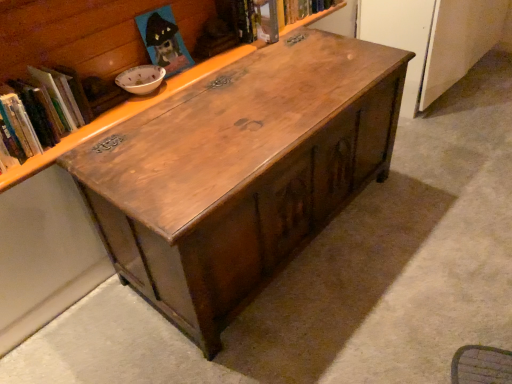
What do you see at coordinates (240, 172) in the screenshot? I see `wooden chest at center` at bounding box center [240, 172].

The width and height of the screenshot is (512, 384). What do you see at coordinates (41, 111) in the screenshot? I see `hardcover book at upper left, marked as the second book in a right-to-left arrangement` at bounding box center [41, 111].

Image resolution: width=512 pixels, height=384 pixels. What do you see at coordinates (120, 116) in the screenshot?
I see `wooden chest at center` at bounding box center [120, 116].

Locate an element on the screen. Image resolution: width=512 pixels, height=384 pixels. wooden chest at center is located at coordinates (240, 172).

In terms of height, does wooden chest at center look taller or shorter compared to hardcover book at upper left, arranged as the second book when viewed from the back?

wooden chest at center is taller than hardcover book at upper left, arranged as the second book when viewed from the back.

Which of these two, wooden chest at center or hardcover book at upper left, marked as the second book in a right-to-left arrangement, is bigger?

wooden chest at center is bigger.

Is wooden chest at center at the left side of hardcover book at upper left, the first book in the front-to-back sequence?

In fact, wooden chest at center is to the right of hardcover book at upper left, the first book in the front-to-back sequence.

Are wooden chest at center and hardcover book at upper left, marked as the second book in a right-to-left arrangement, making contact?

There is a gap between wooden chest at center and hardcover book at upper left, marked as the second book in a right-to-left arrangement.

Can you confirm if wooden chest at center is shorter than hardcover book at upper left, arranged as the second book when viewed from the back?

No, wooden chest at center is not shorter than hardcover book at upper left, arranged as the second book when viewed from the back.

Identify the location of the 1st book directly beneath the wooden chest at center (from a real-world perspective). This screenshot has height=384, width=512. (41, 111).

Considering the positions of objects wooden chest at center and hardcover book at upper left, the first book in the front-to-back sequence, in the image provided, who is behind, wooden chest at center or hardcover book at upper left, the first book in the front-to-back sequence,?

hardcover book at upper left, the first book in the front-to-back sequence, is behind.

From the image's perspective, would you say wooden chest at center is shown under wooden chest at center?

Incorrect, from the image's perspective, wooden chest at center is higher than wooden chest at center.

Can you tell me how much wooden chest at center and wooden chest at center differ in facing direction?

The angular difference between wooden chest at center and wooden chest at center is 0.000761 degrees.

Does point (24, 173) appear closer or farther from the camera than point (291, 217)?

Point (24, 173) is closer to the camera than point (291, 217).

Can we say wooden chest at center lies outside wooden chest at center?

Absolutely, wooden chest at center is external to wooden chest at center.

Which object is positioned more to the right, hardcover book at upper center, positioned as the 1th book in top-to-bottom order, or wooden chest at center?

Positioned to the right is hardcover book at upper center, positioned as the 1th book in top-to-bottom order.

Is wooden chest at center inside hardcover book at upper center, acting as the second book starting from the left?

Definitely not — wooden chest at center is not inside hardcover book at upper center, acting as the second book starting from the left.

Is hardcover book at upper center, acting as the second book starting from the left, far away from wooden chest at center?

That's not correct — hardcover book at upper center, acting as the second book starting from the left, is a little close to wooden chest at center.

Which of these two, hardcover book at upper center, which is counted as the first book, starting from the right, or wooden chest at center, is smaller?

With smaller size is hardcover book at upper center, which is counted as the first book, starting from the right.

Considering the relative sizes of hardcover book at upper center, positioned as the 1th book in top-to-bottom order, and wooden chest at center in the image provided, is hardcover book at upper center, positioned as the 1th book in top-to-bottom order, bigger than wooden chest at center?

Incorrect, hardcover book at upper center, positioned as the 1th book in top-to-bottom order, is not larger than wooden chest at center.

Is hardcover book at upper center, placed as the first book when sorted from back to front, not near wooden chest at center?

hardcover book at upper center, placed as the first book when sorted from back to front, is actually quite close to wooden chest at center.

From a real-world perspective, is hardcover book at upper center, acting as the second book starting from the left, physically below wooden chest at center?

Yes, from a real-world perspective, hardcover book at upper center, acting as the second book starting from the left, is below wooden chest at center.

Considering their positions, is hardcover book at upper left, the first book in the left-to-right sequence, located in front of or behind wooden chest at center?

Clearly, hardcover book at upper left, the first book in the left-to-right sequence, is behind wooden chest at center.

Can you tell me how much hardcover book at upper left, marked as the second book in a right-to-left arrangement, and wooden chest at center differ in facing direction?

There is a 0.00144-degree angle between the facing directions of hardcover book at upper left, marked as the second book in a right-to-left arrangement, and wooden chest at center.

Is hardcover book at upper left, the first book in the front-to-back sequence, aimed at wooden chest at center?

Yes, hardcover book at upper left, the first book in the front-to-back sequence, is oriented towards wooden chest at center.

Measure the distance between hardcover book at upper left, arranged as the second book when viewed from the back, and wooden chest at center.

The distance of hardcover book at upper left, arranged as the second book when viewed from the back, from wooden chest at center is 14.70 centimeters.

The width and height of the screenshot is (512, 384). Find the location of `table below the hardcover book at upper center, acting as the second book starting from the left (from a real-world perspective)`. table below the hardcover book at upper center, acting as the second book starting from the left (from a real-world perspective) is located at coordinates (240, 172).

Who is bigger, wooden chest at center or hardcover book at upper center, which is counted as the first book, starting from the right?

With larger size is wooden chest at center.

From a real-world perspective, who is located higher, wooden chest at center or hardcover book at upper center, positioned as the 1th book in top-to-bottom order?

hardcover book at upper center, positioned as the 1th book in top-to-bottom order, from a real-world perspective.

Are wooden chest at center and hardcover book at upper center, placed as the first book when sorted from back to front, far apart?

Actually, wooden chest at center and hardcover book at upper center, placed as the first book when sorted from back to front, are a little close together.

You are a GUI agent. You are given a task and a screenshot of the screen. Output one action in this format:
    pyautogui.click(x=<x>, y=<y>)
    Task: Click on the 1st book positioned above the wooden chest at center (from the image's perspective)
    This screenshot has height=384, width=512.
    Given the screenshot: What is the action you would take?
    coord(41,111)

Find the location of a particular element. This screenshot has width=512, height=384. the 1st book below the wooden chest at center (from a real-world perspective) is located at coordinates click(x=41, y=111).

In the scene shown: From the image, which object appears to be nearer to wooden chest at center, wooden chest at center or hardcover book at upper center, acting as the second book starting from the left?

hardcover book at upper center, acting as the second book starting from the left, lies closer to wooden chest at center than the other object.

Which object lies nearer to the anchor point wooden chest at center, hardcover book at upper center, acting as the second book starting from the left, or hardcover book at upper left, marked as the second book in a right-to-left arrangement?

hardcover book at upper left, marked as the second book in a right-to-left arrangement.

Considering their positions, is wooden chest at center positioned further to hardcover book at upper center, marked as the 2th book in a front-to-back arrangement, than hardcover book at upper left, arranged as the second book when viewed from the back?

The object further to hardcover book at upper center, marked as the 2th book in a front-to-back arrangement, is hardcover book at upper left, arranged as the second book when viewed from the back.

When comparing their distances from hardcover book at upper left, the first book in the left-to-right sequence, does wooden chest at center or hardcover book at upper center, acting as the second book starting from the left, seem closer?

Based on the image, wooden chest at center appears to be nearer to hardcover book at upper left, the first book in the left-to-right sequence.

Estimate the real-world distances between objects in this image. Which object is further from hardcover book at upper center, positioned as the 1th book in top-to-bottom order, wooden chest at center or wooden chest at center?

wooden chest at center.

From the image, which object appears to be farther from wooden chest at center, hardcover book at upper left, the first book in the left-to-right sequence, or hardcover book at upper center, positioned as the 1th book in top-to-bottom order?

Among the two, hardcover book at upper center, positioned as the 1th book in top-to-bottom order, is located further to wooden chest at center.

When comparing their distances from wooden chest at center, does hardcover book at upper left, the first book in the left-to-right sequence, or wooden chest at center seem closer?

The object closer to wooden chest at center is wooden chest at center.

Looking at the image, which one is located closer to wooden chest at center, wooden chest at center or hardcover book at upper left, the first book in the left-to-right sequence?

The object closer to wooden chest at center is wooden chest at center.

Identify the location of book between wooden chest at center and hardcover book at upper center, placed as the first book when sorted from back to front, from front to back. This screenshot has width=512, height=384. (41, 111).

At what (x,y) coordinates should I click in order to perform the action: click on table between wooden chest at center and hardcover book at upper center, marked as the 2th book in a front-to-back arrangement, from front to back. Please return your answer as a coordinate pair (x, y). This screenshot has height=384, width=512. Looking at the image, I should click on (240, 172).

Locate an element on the screen. The height and width of the screenshot is (384, 512). book between wooden chest at center and hardcover book at upper center, placed as the first book when sorted from back to front, from front to back is located at coordinates (41, 111).

Identify the location of bookcase situated between hardcover book at upper left, which ranks as the second book in top-to-bottom order, and wooden chest at center from left to right. (120, 116).